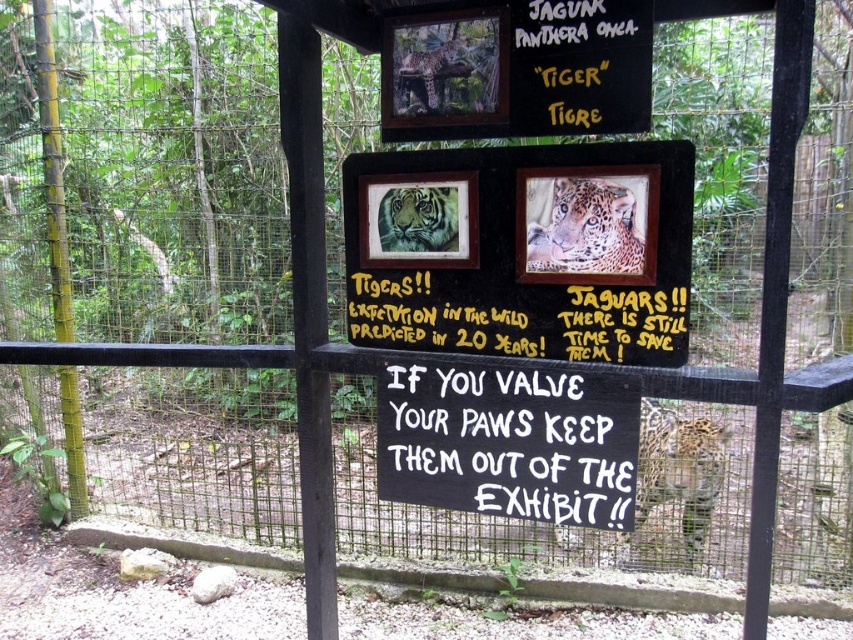
What is the height relationship between the wooden signboard at center and the sandy fur tiger at center?

The wooden signboard at center has a greater height compared to the sandy fur tiger at center.

You are a zookeeper standing at the camera position. You want to clean the spotted fur jaguar at center display board. Can you reach it with a 3.5 meter extension pole?

The spotted fur jaguar at center and camera are 3.61 meters apart. The extension pole is only 3.5 meters, so you cannot reach the spotted fur jaguar at center with the pole.

Consider the image. What is the spatial relationship between the black chalkboard at center and the brown fur jaguar at upper center?

The black chalkboard at center is located below the brown fur jaguar at upper center.